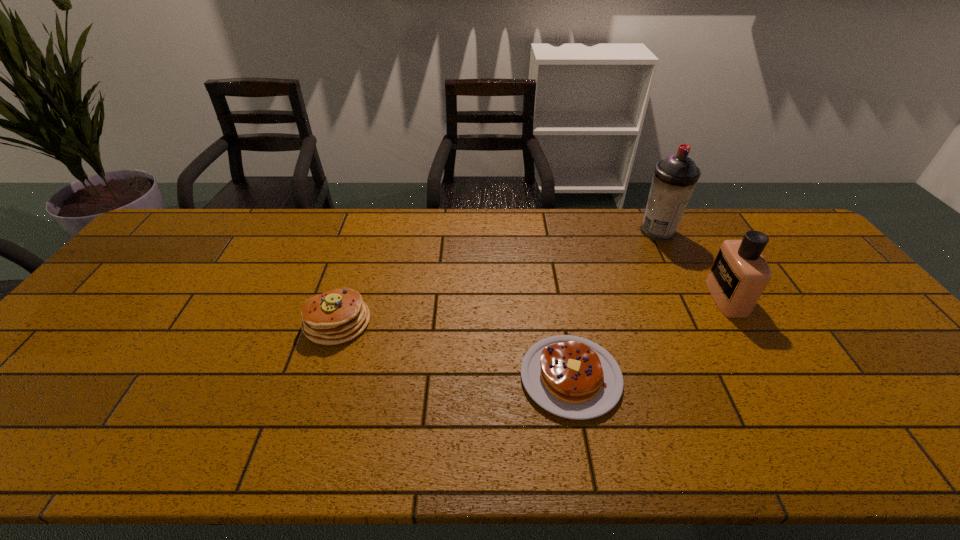
At what (x,y) coordinates should I click in order to perform the action: click on vacant area between the right pancake and the perfume. Please return your answer as a coordinate pair (x, y). The image size is (960, 540). Looking at the image, I should click on (648, 338).

The height and width of the screenshot is (540, 960). What are the coordinates of `vacant space that is in between the second tallest object and the shortest object` in the screenshot? It's located at (648, 338).

The image size is (960, 540). What are the coordinates of `blank region between the second shortest object and the shortest object` in the screenshot? It's located at point(454,349).

Where is `vacant region between the right pancake and the left pancake`? The height and width of the screenshot is (540, 960). vacant region between the right pancake and the left pancake is located at coordinates (454, 349).

Find the location of a particular element. Image resolution: width=960 pixels, height=540 pixels. free space between the tallest object and the taller pancake is located at coordinates (497, 277).

You are a GUI agent. You are given a task and a screenshot of the screen. Output one action in this format:
    pyautogui.click(x=<x>, y=<y>)
    Task: Click on the vacant point located between the leftmost object and the perfume
    The image size is (960, 540).
    Given the screenshot: What is the action you would take?
    pyautogui.click(x=532, y=310)

At what (x,y) coordinates should I click in order to perform the action: click on empty space between the tallest object and the right pancake. Please return your answer as a coordinate pair (x, y). Looking at the image, I should click on (614, 305).

Locate an element on the screen. This screenshot has height=540, width=960. vacant point located between the third object from right to left and the aerosol can is located at coordinates (614, 305).

Point out which object is positioned as the third nearest to the leftmost object. Please provide its 2D coordinates. Your answer should be formatted as a tuple, i.e. [(x, y)], where the tuple contains the x and y coordinates of a point satisfying the conditions above.

[(739, 275)]

Choose which object is the second nearest neighbor to the taller pancake. Please provide its 2D coordinates. Your answer should be formatted as a tuple, i.e. [(x, y)], where the tuple contains the x and y coordinates of a point satisfying the conditions above.

[(675, 177)]